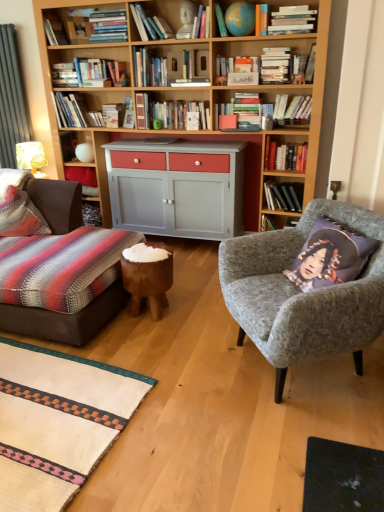
How much space does hardcover book at upper center, placed as the eleventh book when sorted from right to left, occupy vertically?

It is 9.97 inches.

What do you see at coordinates (240, 113) in the screenshot? The width and height of the screenshot is (384, 512). I see `hardcover books at upper center, acting as the 10th book starting from the left` at bounding box center [240, 113].

This screenshot has width=384, height=512. What are the coordinates of `matte blue globe at upper center, positioned as the eighth book in right-to-left order` in the screenshot? It's located at (221, 21).

The width and height of the screenshot is (384, 512). Describe the element at coordinates (285, 156) in the screenshot. I see `hardcover books at upper right, the 13th book from the left` at that location.

Measure the distance between hardcover book at upper center, the 7th book from the left, and camera.

3.29 meters.

What do you see at coordinates (275, 65) in the screenshot?
I see `hardcover books at upper center, which ranks as the 11th book in left-to-right order` at bounding box center [275, 65].

In order to click on brown leather stool at center in this screenshot , I will do `click(148, 284)`.

From a real-world perspective, is brown leather stool at center positioned above or below hardcover book at upper center, which ranks as the 5th book in left-to-right order?

brown leather stool at center is situated lower than hardcover book at upper center, which ranks as the 5th book in left-to-right order, in the real world.

From the image's perspective, does brown leather stool at center appear higher than hardcover book at upper center, which ranks as the 5th book in left-to-right order?

No, from the image's perspective, brown leather stool at center is not on top of hardcover book at upper center, which ranks as the 5th book in left-to-right order.

Consider the image. Could you tell me if brown leather stool at center is turned towards hardcover book at upper center, placed as the eleventh book when sorted from right to left?

No, brown leather stool at center is not facing towards hardcover book at upper center, placed as the eleventh book when sorted from right to left.

Looking at this image, considering the sizes of objects brown leather stool at center and hardcover book at upper center, placed as the eleventh book when sorted from right to left, in the image provided, who is wider, brown leather stool at center or hardcover book at upper center, placed as the eleventh book when sorted from right to left,?

Wider between the two is brown leather stool at center.

In terms of size, does hardcover book at upper center, positioned as the 15th book in left-to-right order, appear bigger or smaller than hardcover books at center, marked as the fourteenth book in a left-to-right arrangement?

hardcover book at upper center, positioned as the 15th book in left-to-right order, is smaller than hardcover books at center, marked as the fourteenth book in a left-to-right arrangement.

From the image's perspective, which is below, hardcover book at upper center, marked as the 1th book in a right-to-left arrangement, or hardcover books at center, marked as the fourteenth book in a left-to-right arrangement?

hardcover books at center, marked as the fourteenth book in a left-to-right arrangement, appears lower in the image.

Considering their positions, is hardcover book at upper center, positioned as the 15th book in left-to-right order, located in front of or behind hardcover books at center, marked as the fourteenth book in a left-to-right arrangement?

Visually, hardcover book at upper center, positioned as the 15th book in left-to-right order, is located in front of hardcover books at center, marked as the fourteenth book in a left-to-right arrangement.

Is hardcover book at upper center, positioned as the 15th book in left-to-right order, to the left of hardcover books at center, the second book in the right-to-left sequence, from the viewer's perspective?

In fact, hardcover book at upper center, positioned as the 15th book in left-to-right order, is to the right of hardcover books at center, the second book in the right-to-left sequence.

Looking at this image, considering the sizes of objects purple fabric cushion at right and matte blue globe at upper center, which is counted as the 8th book, starting from the left, in the image provided, who is taller, purple fabric cushion at right or matte blue globe at upper center, which is counted as the 8th book, starting from the left,?

purple fabric cushion at right is taller.

Is purple fabric cushion at right not within matte blue globe at upper center, which is counted as the 8th book, starting from the left?

Absolutely, purple fabric cushion at right is external to matte blue globe at upper center, which is counted as the 8th book, starting from the left.

From the image's perspective, is purple fabric cushion at right positioned above or below matte blue globe at upper center, which is counted as the 8th book, starting from the left?

From the image's perspective, purple fabric cushion at right appears below matte blue globe at upper center, which is counted as the 8th book, starting from the left.

Considering the relative positions of purple fabric cushion at right and matte blue globe at upper center, which is counted as the 8th book, starting from the left, in the image provided, is purple fabric cushion at right to the left of matte blue globe at upper center, which is counted as the 8th book, starting from the left, from the viewer's perspective?

In fact, purple fabric cushion at right is to the right of matte blue globe at upper center, which is counted as the 8th book, starting from the left.

Considering the positions of objects hardcover book at center, the 6th book positioned from the left, and matte blue globe at upper center, positioned as the eighth book in right-to-left order, in the image provided, who is more to the left, hardcover book at center, the 6th book positioned from the left, or matte blue globe at upper center, positioned as the eighth book in right-to-left order,?

From the viewer's perspective, hardcover book at center, the 6th book positioned from the left, appears more on the left side.

Is hardcover book at center, the 10th book when ordered from right to left, wider or thinner than matte blue globe at upper center, positioned as the eighth book in right-to-left order?

→ Clearly, hardcover book at center, the 10th book when ordered from right to left, has more width compared to matte blue globe at upper center, positioned as the eighth book in right-to-left order.

Can you confirm if hardcover book at center, the 6th book positioned from the left, is taller than matte blue globe at upper center, which is counted as the 8th book, starting from the left?

Yes, hardcover book at center, the 6th book positioned from the left, is taller than matte blue globe at upper center, which is counted as the 8th book, starting from the left.

Between hardcover book at center, the 6th book positioned from the left, and matte blue globe at upper center, which is counted as the 8th book, starting from the left, which one has larger size?

With larger size is hardcover book at center, the 6th book positioned from the left.

Is point (309, 115) less distant than point (279, 146)?

Yes, it is in front of point (279, 146).

Can you confirm if hardcover book at upper center, marked as the 1th book in a right-to-left arrangement, is shorter than hardcover books at upper right, the 13th book from the left?

No.

Looking at this image, from a real-world perspective, between striped fabric pillow at left and hardcover books at upper center, the 6th book from the right, who is vertically higher?

hardcover books at upper center, the 6th book from the right, is physically above.

Is striped fabric pillow at left with hardcover books at upper center, acting as the 10th book starting from the left?

striped fabric pillow at left and hardcover books at upper center, acting as the 10th book starting from the left, are not in contact.

Relative to hardcover books at upper center, the 6th book from the right, is striped fabric pillow at left in front or behind?

Clearly, striped fabric pillow at left is in front of hardcover books at upper center, the 6th book from the right.

Are hardcover books at center, marked as the fourteenth book in a left-to-right arrangement, and striped fabric pillow at left far apart?

Yes.

Considering the positions of point (282, 200) and point (25, 204), is point (282, 200) closer or farther from the camera than point (25, 204)?

Point (282, 200) is farther from the camera than point (25, 204).

You are a GUI agent. You are given a task and a screenshot of the screen. Output one action in this format:
    pyautogui.click(x=<x>, y=<y>)
    Task: Click on the pillow in front of the hardcover books at center, the second book in the right-to-left sequence
    
    Given the screenshot: What is the action you would take?
    pyautogui.click(x=20, y=215)

Looking at this image, which of these two, hardcover books at center, the second book in the right-to-left sequence, or striped fabric pillow at left, is thinner?

Thinner between the two is hardcover books at center, the second book in the right-to-left sequence.

You are a GUI agent. You are given a task and a screenshot of the screen. Output one action in this format:
    pyautogui.click(x=<x>, y=<y>)
    Task: Click on the 14th book above the brown leather stool at center (from the image's perspective)
    The image size is (384, 512).
    Given the screenshot: What is the action you would take?
    pyautogui.click(x=108, y=26)

Find the location of `the 1st book to the left when counting from the hardcover book at upper center, marked as the 1th book in a right-to-left arrangement`. the 1st book to the left when counting from the hardcover book at upper center, marked as the 1th book in a right-to-left arrangement is located at coordinates (283, 196).

Which object lies further to the anchor point hardcover book at upper left, which is the second book from left to right, hardcover book at upper left, which is counted as the fifteenth book, starting from the right, or hardcover book at upper center, the 7th book from the left?

Based on the image, hardcover book at upper center, the 7th book from the left, appears to be further to hardcover book at upper left, which is the second book from left to right.

Estimate the real-world distances between objects in this image. Which object is closer to purple fabric cushion at right, gray fabric armchair at right or hardcover book at upper center, acting as the 12th book starting from the right?

gray fabric armchair at right is closer to purple fabric cushion at right.

When comparing their distances from hardcover books at center, marked as the fourteenth book in a left-to-right arrangement, does hardcover book at upper center, which ranks as the 5th book in left-to-right order, or striped fabric pillow at left seem closer?

hardcover book at upper center, which ranks as the 5th book in left-to-right order, lies closer to hardcover books at center, marked as the fourteenth book in a left-to-right arrangement, than the other object.

Estimate the real-world distances between objects in this image. Which object is further from purple fabric cushion at right, hardcover book at upper center, positioned as the fourth book in left-to-right order, or striped fabric pillow at left?

Based on the image, hardcover book at upper center, positioned as the fourth book in left-to-right order, appears to be further to purple fabric cushion at right.

From the image, which object appears to be nearer to hardcover book at upper left, which is the third book from left to right, hardcover books at upper center, acting as the 10th book starting from the left, or hardcover book at upper center, positioned as the 15th book in left-to-right order?

Based on the image, hardcover books at upper center, acting as the 10th book starting from the left, appears to be nearer to hardcover book at upper left, which is the third book from left to right.

Estimate the real-world distances between objects in this image. Which object is closer to hardcover book at upper left, which is the 1th book in left-to-right order, matte blue globe at upper center, which is counted as the 8th book, starting from the left, or striped fabric pillow at left?

The object closer to hardcover book at upper left, which is the 1th book in left-to-right order, is matte blue globe at upper center, which is counted as the 8th book, starting from the left.

Looking at the image, which one is located closer to hardcover book at upper center, placed as the eleventh book when sorted from right to left, hardcover book at upper center, marked as the 1th book in a right-to-left arrangement, or hardcover books at center, the second book in the right-to-left sequence?

hardcover book at upper center, marked as the 1th book in a right-to-left arrangement.

From the image, which object appears to be nearer to hardcover book at upper left, which is the second book from left to right, white matte book at upper center, arranged as the 12th book when viewed from the left, or hardcover book at upper center, positioned as the fourth book in left-to-right order?

hardcover book at upper center, positioned as the fourth book in left-to-right order, lies closer to hardcover book at upper left, which is the second book from left to right, than the other object.

You are a GUI agent. You are given a task and a screenshot of the screen. Output one action in this format:
    pyautogui.click(x=<x>, y=<y>)
    Task: Click on the side table between purple fabric cushion at right and hardcover books at center, the second book in the right-to-left sequence, from front to back
    The image size is (384, 512).
    Given the screenshot: What is the action you would take?
    pyautogui.click(x=148, y=284)

At what (x,y) coordinates should I click in order to perform the action: click on throw pillow between striped fabric pillow at left and white matte book at upper center, arranged as the 4th book when viewed from the right, in the horizontal direction. Please return your answer as a coordinate pair (x, y). Looking at the image, I should click on (330, 255).

In order to click on throw pillow between hardcover book at upper center, which is the 7th book in right-to-left order, and gray fabric armchair at right from top to bottom in this screenshot , I will do `click(330, 255)`.

At what (x,y) coordinates should I click in order to perform the action: click on side table between hardcover book at upper center, the 7th book from the left, and gray fabric armchair at right in the up-down direction. Please return your answer as a coordinate pair (x, y). This screenshot has width=384, height=512. Looking at the image, I should click on (148, 284).